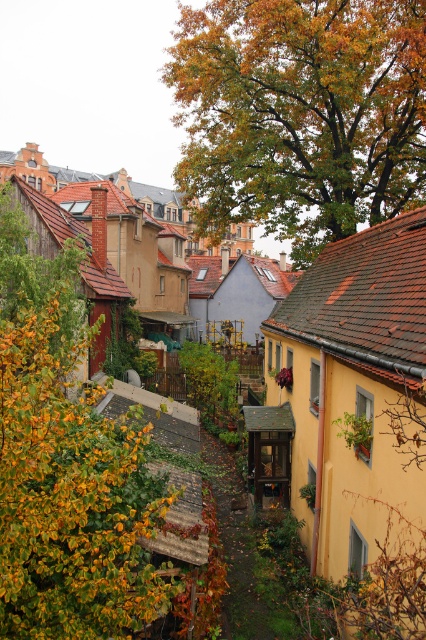
In the scene shown: Is green leafy tree at upper center shorter than green leafy tree at left?

No, green leafy tree at upper center is not shorter than green leafy tree at left.

Can you confirm if green leafy tree at upper center is positioned to the right of green leafy tree at left?

Indeed, green leafy tree at upper center is positioned on the right side of green leafy tree at left.

Who is more forward, (226, 160) or (123, 435)?

Positioned in front is point (123, 435).

Identify the location of green leafy tree at upper center. (301, 115).